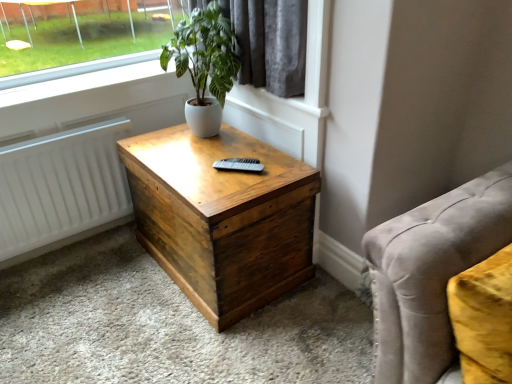
Question: Considering their positions, is wooden nightstand at center located in front of or behind white matte radiator at left?

Choices:
 (A) behind
 (B) front

Answer: (B)

Question: Considering the positions of point 279,165 and point 74,148, is point 279,165 closer or farther from the camera than point 74,148?

Choices:
 (A) farther
 (B) closer

Answer: (B)

Question: Estimate the real-world distances between objects in this image. Which object is closer to the white matte radiator at left?

Choices:
 (A) velvet gray studio couch at lower right
 (B) wooden nightstand at center
 (C) green leafy plant at upper center

Answer: (B)

Question: Considering the real-world distances, which object is farthest from the white matte radiator at left?

Choices:
 (A) velvet gray studio couch at lower right
 (B) green leafy plant at upper center
 (C) wooden nightstand at center

Answer: (A)